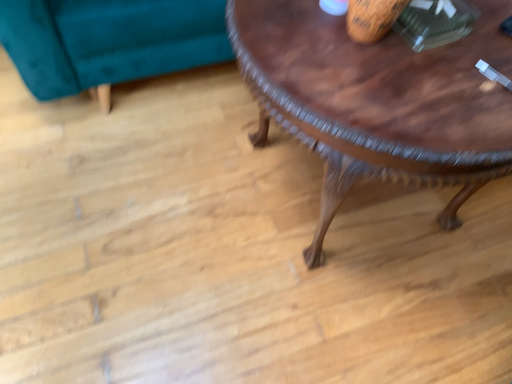
Question: Is teal velvet swivel chair at upper left inside the boundaries of wooden carved coffee table at center, or outside?

Choices:
 (A) inside
 (B) outside

Answer: (B)

Question: Looking at the image, does teal velvet swivel chair at upper left seem bigger or smaller compared to wooden carved coffee table at center?

Choices:
 (A) small
 (B) big

Answer: (A)

Question: In terms of width, does teal velvet swivel chair at upper left look wider or thinner when compared to wooden carved coffee table at center?

Choices:
 (A) wide
 (B) thin

Answer: (A)

Question: From a real-world perspective, is wooden carved coffee table at center physically located above or below teal velvet swivel chair at upper left?

Choices:
 (A) below
 (B) above

Answer: (B)

Question: Considering their positions, is wooden carved coffee table at center located in front of or behind teal velvet swivel chair at upper left?

Choices:
 (A) behind
 (B) front

Answer: (B)

Question: In terms of height, does wooden carved coffee table at center look taller or shorter compared to teal velvet swivel chair at upper left?

Choices:
 (A) tall
 (B) short

Answer: (A)

Question: Does point (504, 104) appear closer or farther from the camera than point (156, 6)?

Choices:
 (A) closer
 (B) farther

Answer: (A)